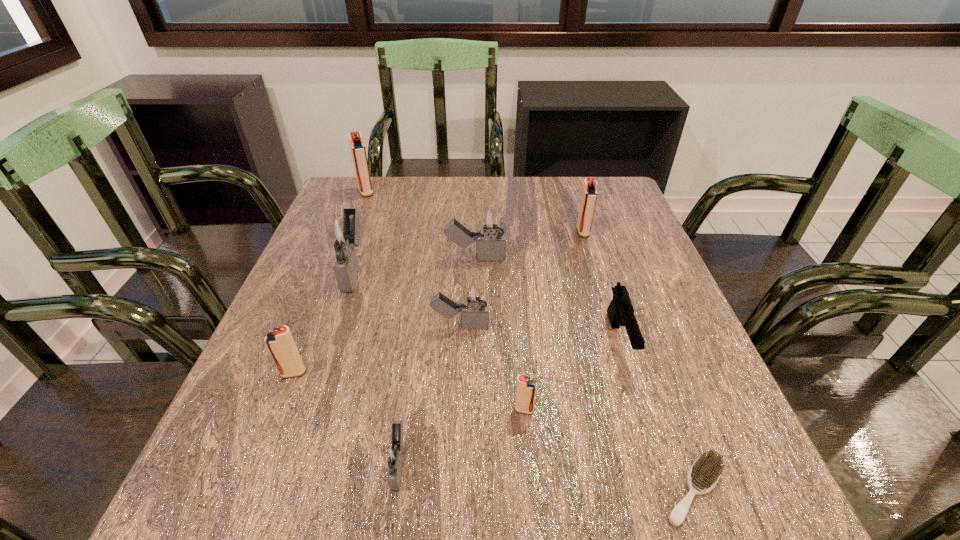
Where is `the farthest red igniter`? Image resolution: width=960 pixels, height=540 pixels. the farthest red igniter is located at coordinates (358, 150).

Locate an element on the screen. Image resolution: width=960 pixels, height=540 pixels. the farthest igniter is located at coordinates (358, 150).

What are the coordinates of `the leftmost gray igniter` in the screenshot? It's located at (341, 234).

You are a GUI agent. You are given a task and a screenshot of the screen. Output one action in this format:
    pyautogui.click(x=<x>, y=<y>)
    Task: Click on the third smallest red igniter
    This screenshot has height=540, width=960.
    Given the screenshot: What is the action you would take?
    pyautogui.click(x=589, y=194)

Find the location of a particular element. the third nearest red igniter is located at coordinates (589, 194).

The image size is (960, 540). I want to click on the third smallest gray igniter, so coord(490,222).

The height and width of the screenshot is (540, 960). I want to click on the fifth farthest igniter, so click(475, 315).

This screenshot has height=540, width=960. What are the coordinates of `the second smallest gray igniter` in the screenshot? It's located at (475, 315).

Where is `the third nearest igniter`? the third nearest igniter is located at coordinates (280, 342).

Image resolution: width=960 pixels, height=540 pixels. Identify the location of the third biggest red igniter. (280, 342).